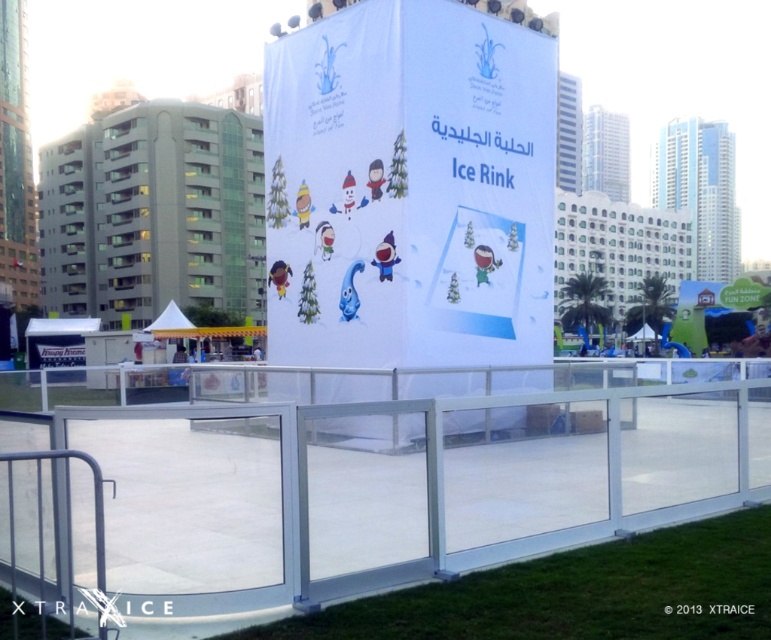
You are standing at the entrance of the ice rink and want to locate the clear plastic rail at center and the white paper ice rink at center. According to their positions, which one is on the left side?

The clear plastic rail at center is to the left of white paper ice rink at center, so the clear plastic rail at center is on the left side.

You are a parent trying to secure your child near the clear plastic rail at center and the white paper ice rink at center. Considering their heights, which object is taller and would provide a better view?

The clear plastic rail at center is taller than the white paper ice rink at center, so it would provide a better view for the parent to secure their child.

You are standing at the entrance of the ice rink and want to see the banner above. Which object between the clear plastic rail at center and the white paper ice rink at center is closer to you, blocking your view?

The clear plastic rail at center is in front of the white paper ice rink at center, so it is closer to you and blocking your view.